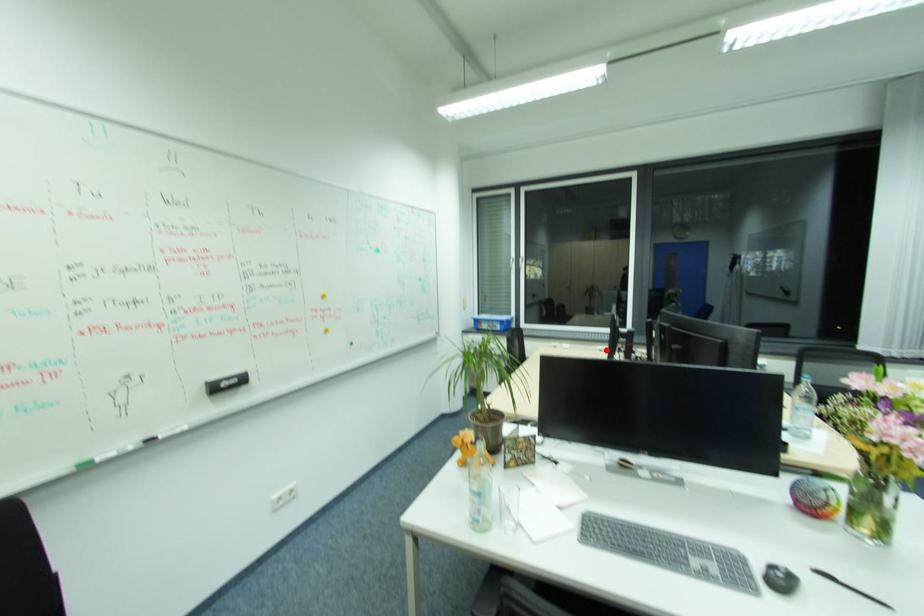
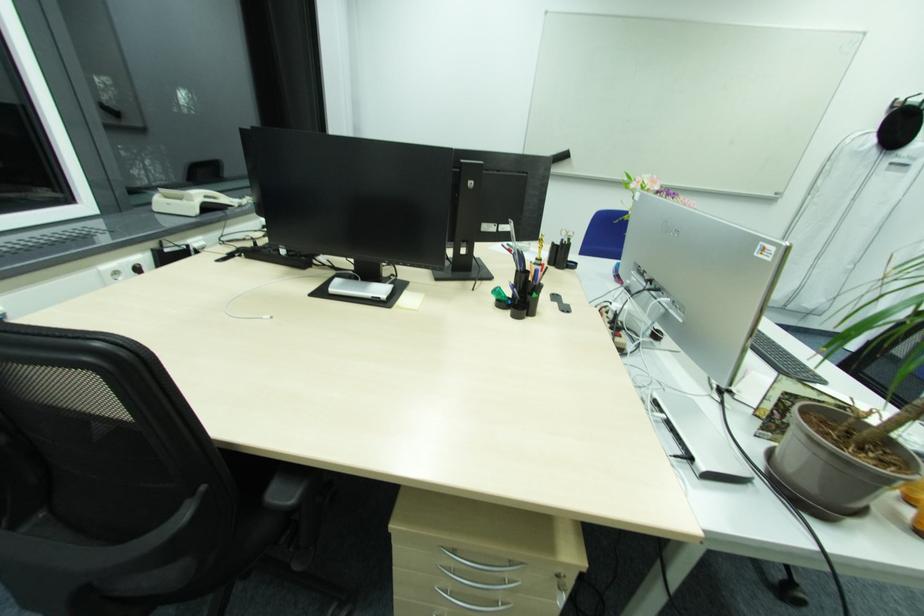
Locate, in the second image, the point that corresponds to the highlighted location in the first image.

(120, 272)